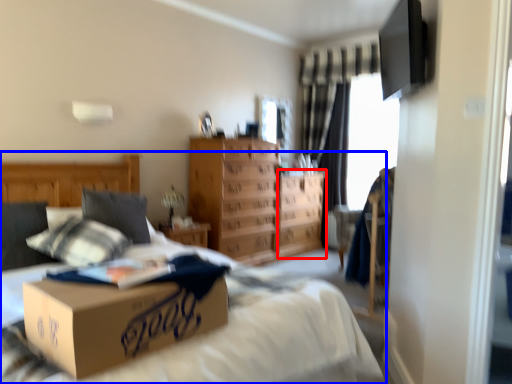
Question: Which point is closer to the camera, vanity (highlighted by a red box) or bed (highlighted by a blue box)?

Choices:
 (A) vanity
 (B) bed

Answer: (B)